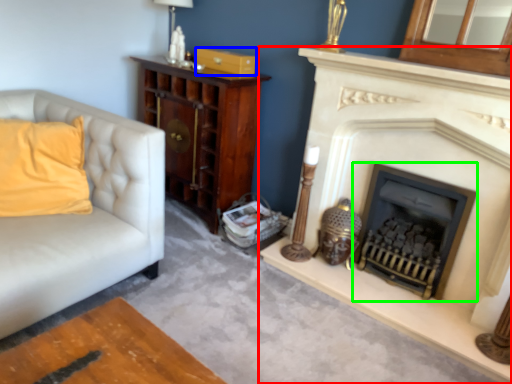
Question: Which object is the farthest from fireplace (highlighted by a red box)? Choose among these: drawer (highlighted by a blue box) or wood burning stove (highlighted by a green box).

Choices:
 (A) drawer
 (B) wood burning stove

Answer: (A)